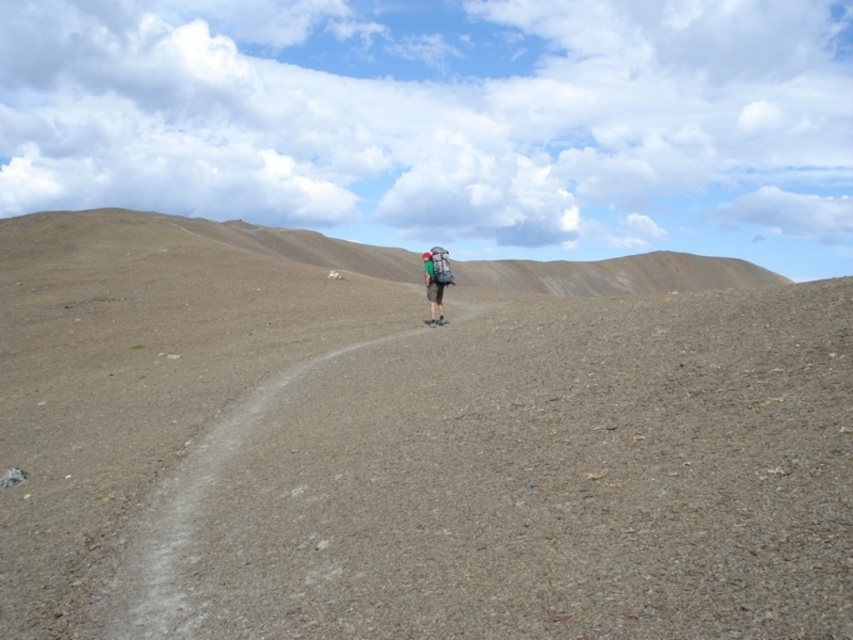
Question: Which object appears closest to the camera in this image?

Choices:
 (A) green fabric backpack at center
 (B) brown gravel path at center

Answer: (B)

Question: Is brown gravel path at center thinner than green fabric backpack at center?

Choices:
 (A) no
 (B) yes

Answer: (A)

Question: Is brown gravel path at center thinner than green fabric backpack at center?

Choices:
 (A) no
 (B) yes

Answer: (A)

Question: Is brown gravel path at center to the left of green fabric backpack at center from the viewer's perspective?

Choices:
 (A) no
 (B) yes

Answer: (B)